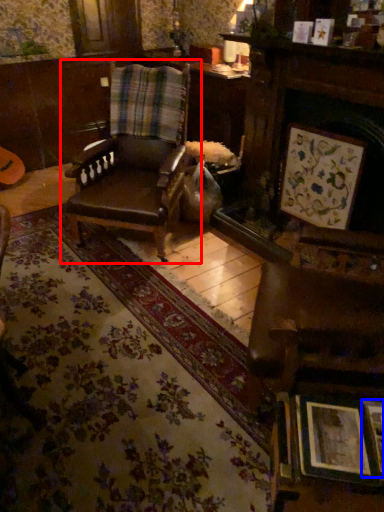
Question: Which object appears closest to the camera in this image, chair (highlighted by a red box) or picture frame (highlighted by a blue box)?

Choices:
 (A) chair
 (B) picture frame

Answer: (B)